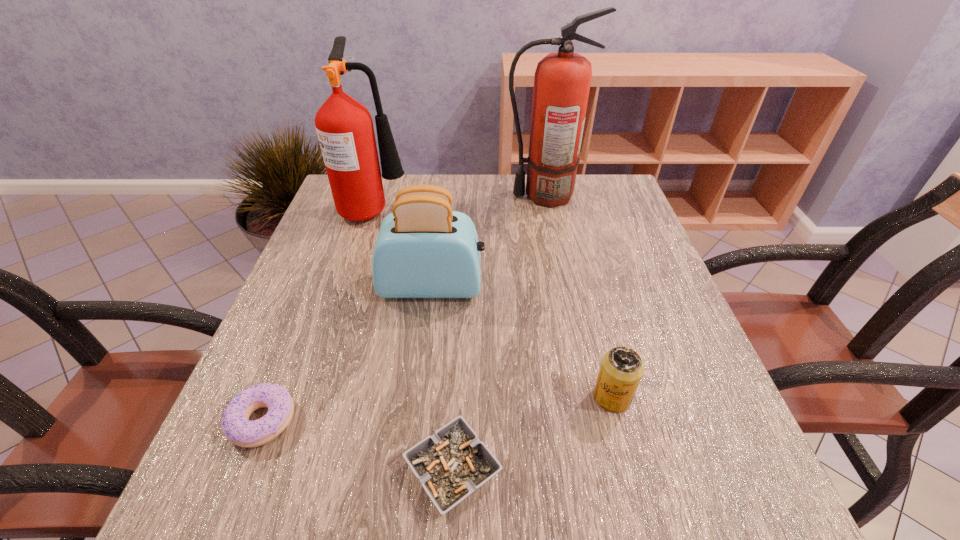
The height and width of the screenshot is (540, 960). In order to click on the right fire extinguisher in this screenshot , I will do `click(562, 80)`.

What are the coordinates of `the second tallest object` in the screenshot? It's located at (344, 126).

You are a GUI agent. You are given a task and a screenshot of the screen. Output one action in this format:
    pyautogui.click(x=<x>, y=<y>)
    Task: Click on the left fire extinguisher
    This screenshot has width=960, height=540.
    Given the screenshot: What is the action you would take?
    pyautogui.click(x=344, y=126)

Image resolution: width=960 pixels, height=540 pixels. In order to click on toaster in this screenshot , I will do `click(423, 249)`.

Where is `the fourth shortest object`? the fourth shortest object is located at coordinates (423, 249).

Locate an element on the screen. The width and height of the screenshot is (960, 540). beer can is located at coordinates (621, 370).

I want to click on the fifth tallest object, so click(235, 423).

Where is `ashtray`? The image size is (960, 540). ashtray is located at coordinates (453, 463).

At what (x,y) coordinates should I click in order to perform the action: click on vacant region located 0.060m on the nozzle of the right fire extinguisher. Please return your answer as a coordinate pair (x, y). Looking at the image, I should click on (482, 195).

Where is `vacant point located on the nozzle of the right fire extinguisher`? Image resolution: width=960 pixels, height=540 pixels. vacant point located on the nozzle of the right fire extinguisher is located at coordinates (468, 195).